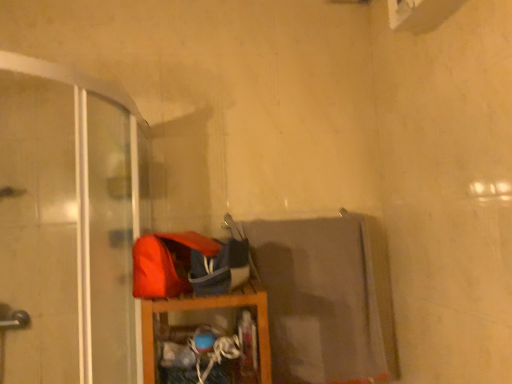
What is the approximate height of wooden shelf at lower center?

wooden shelf at lower center is 10.47 inches in height.

This screenshot has width=512, height=384. Identify the location of wooden shelf at lower center. (208, 308).

Image resolution: width=512 pixels, height=384 pixels. What do you see at coordinates (208, 308) in the screenshot?
I see `wooden shelf at lower center` at bounding box center [208, 308].

Where is `transparent plastic screen door at left`? This screenshot has width=512, height=384. transparent plastic screen door at left is located at coordinates (68, 225).

What do you see at coordinates (68, 225) in the screenshot? I see `transparent plastic screen door at left` at bounding box center [68, 225].

Image resolution: width=512 pixels, height=384 pixels. I want to click on wooden shelf at lower center, so click(x=208, y=308).

Which object is positioned more to the right, wooden shelf at lower center or transparent plastic screen door at left?

From the viewer's perspective, wooden shelf at lower center appears more on the right side.

Does wooden shelf at lower center lie in front of transparent plastic screen door at left?

No, it is not.

Considering the points (151, 345) and (3, 145), which point is in front, point (151, 345) or point (3, 145)?

The point (151, 345) is more forward.

From the image's perspective, is wooden shelf at lower center positioned above or below transparent plastic screen door at left?

wooden shelf at lower center is below transparent plastic screen door at left.

From a real-world perspective, is wooden shelf at lower center beneath transparent plastic screen door at left?

Yes.

Based on the photo, which object is thinner, wooden shelf at lower center or transparent plastic screen door at left?

Thinner between the two is wooden shelf at lower center.

Considering the sizes of wooden shelf at lower center and transparent plastic screen door at left in the image, is wooden shelf at lower center taller or shorter than transparent plastic screen door at left?

Considering their sizes, wooden shelf at lower center has less height than transparent plastic screen door at left.

Is wooden shelf at lower center bigger or smaller than transparent plastic screen door at left?

Considering their sizes, wooden shelf at lower center takes up less space than transparent plastic screen door at left.

Would you say wooden shelf at lower center contains transparent plastic screen door at left?

No.

Is wooden shelf at lower center placed right next to transparent plastic screen door at left?

wooden shelf at lower center and transparent plastic screen door at left are clearly separated.

Is wooden shelf at lower center positioned with its back to transparent plastic screen door at left?

No, wooden shelf at lower center's orientation is not away from transparent plastic screen door at left.

What's the angular difference between wooden shelf at lower center and transparent plastic screen door at left's facing directions?

0.000138 degrees.

Where is `screen door in front of the wooden shelf at lower center`? screen door in front of the wooden shelf at lower center is located at coordinates (68, 225).

Between transparent plastic screen door at left and wooden shelf at lower center, which one appears on the right side from the viewer's perspective?

Positioned to the right is wooden shelf at lower center.

Considering their positions, is transparent plastic screen door at left located in front of or behind wooden shelf at lower center?

transparent plastic screen door at left is in front of wooden shelf at lower center.

Considering the positions of point (17, 123) and point (143, 303), is point (17, 123) closer or farther from the camera than point (143, 303)?

Point (17, 123).

From the image's perspective, is transparent plastic screen door at left above wooden shelf at lower center?

Yes, from the image's perspective, transparent plastic screen door at left is over wooden shelf at lower center.

From a real-world perspective, is transparent plastic screen door at left above or below wooden shelf at lower center?

transparent plastic screen door at left is above wooden shelf at lower center.

Is transparent plastic screen door at left thinner than wooden shelf at lower center?

In fact, transparent plastic screen door at left might be wider than wooden shelf at lower center.

Considering the relative sizes of transparent plastic screen door at left and wooden shelf at lower center in the image provided, is transparent plastic screen door at left shorter than wooden shelf at lower center?

No, transparent plastic screen door at left is not shorter than wooden shelf at lower center.

Is transparent plastic screen door at left bigger than wooden shelf at lower center?

Correct, transparent plastic screen door at left is larger in size than wooden shelf at lower center.

Could wooden shelf at lower center be considered to be inside transparent plastic screen door at left?

That's incorrect, wooden shelf at lower center is not inside transparent plastic screen door at left.

Is transparent plastic screen door at left not near wooden shelf at lower center?

They are positioned close to each other.

Is transparent plastic screen door at left aimed at wooden shelf at lower center?

No, transparent plastic screen door at left is not facing towards wooden shelf at lower center.

Can you tell me how much transparent plastic screen door at left and wooden shelf at lower center differ in facing direction?

The angular difference between transparent plastic screen door at left and wooden shelf at lower center is 0.000138 degrees.

Measure the distance between transparent plastic screen door at left and wooden shelf at lower center.

29.74 inches.

Find the location of a particular element. This screenshot has height=384, width=512. screen door above the wooden shelf at lower center (from a real-world perspective) is located at coordinates (68, 225).

This screenshot has height=384, width=512. What are the coordinates of `screen door above the wooden shelf at lower center (from a real-world perspective)` in the screenshot? It's located at (68, 225).

Locate an element on the screen. furniture lying below the transparent plastic screen door at left (from the image's perspective) is located at coordinates (208, 308).